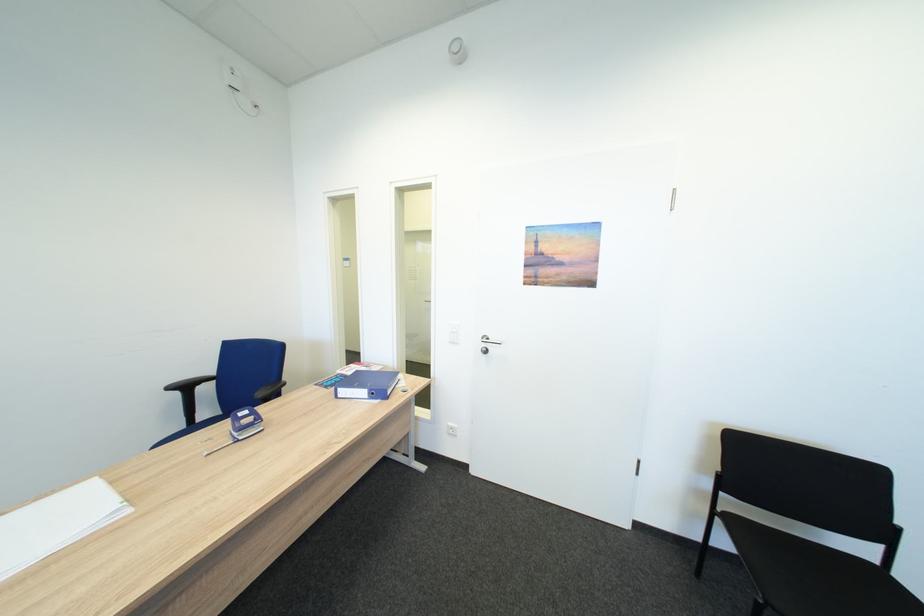
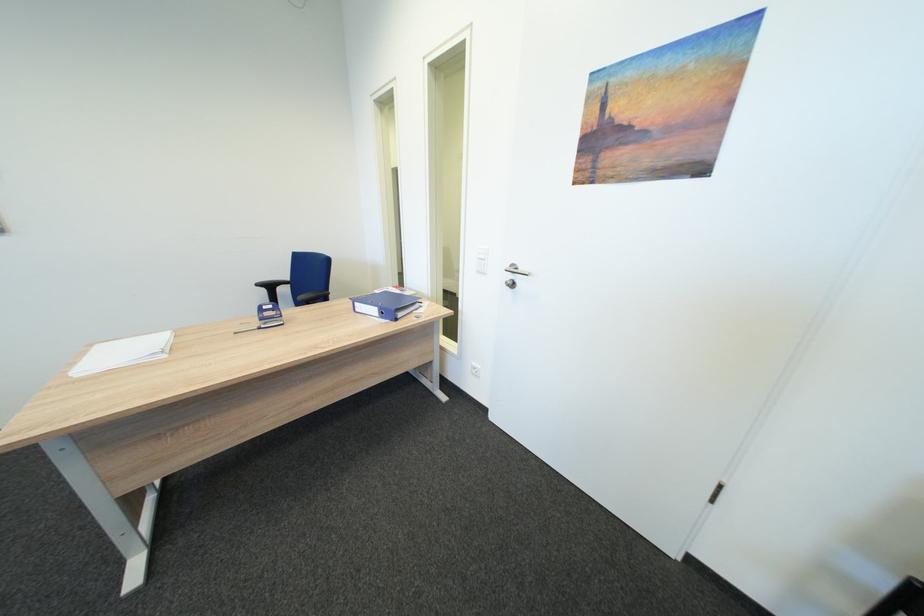
Question: The images are taken continuously from a first-person perspective. In which direction is your viewpoint rotating?

Choices:
 (A) Left
 (B) Right
 (C) Up
 (D) Down

Answer: (A)